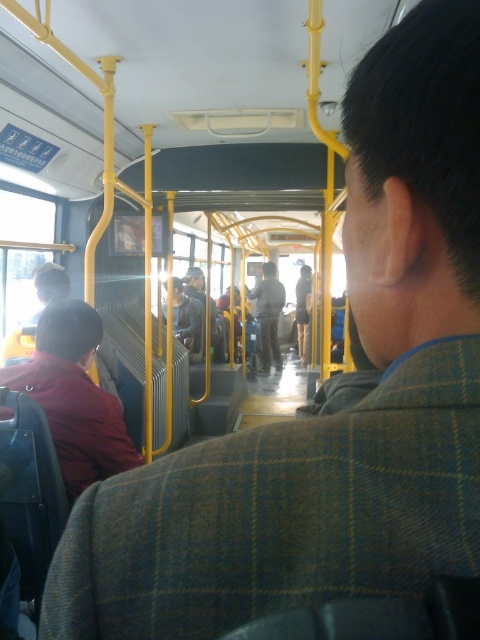
Can you confirm if dark gray sweater at center is bigger than dark gray leather jacket at center?

Actually, dark gray sweater at center might be smaller than dark gray leather jacket at center.

Is dark gray sweater at center closer to the viewer compared to dark gray leather jacket at center?

Yes, dark gray sweater at center is closer to the viewer.

Between point (173, 300) and point (211, 301), which one is positioned in front?

Point (173, 300) is in front.

Where is `dark gray sweater at center`? The width and height of the screenshot is (480, 640). dark gray sweater at center is located at coordinates (186, 317).

Does maroon fabric jacket at left come in front of dark gray fabric jacket at center?

That is True.

Can you confirm if maroon fabric jacket at left is wider than dark gray fabric jacket at center?

In fact, maroon fabric jacket at left might be narrower than dark gray fabric jacket at center.

Between point (96, 444) and point (269, 346), which one is positioned in front?

Point (96, 444) is in front.

The height and width of the screenshot is (640, 480). What are the coordinates of `maroon fabric jacket at left` in the screenshot? It's located at (73, 396).

Locate an element on the screen. The image size is (480, 640). maroon fabric jacket at left is located at coordinates (73, 396).

Does maroon fabric jacket at left have a greater height compared to dark gray sweater at center?

In fact, maroon fabric jacket at left may be shorter than dark gray sweater at center.

Who is more forward, (66, 417) or (180, 333)?

Positioned in front is point (66, 417).

Locate an element on the screen. maroon fabric jacket at left is located at coordinates (73, 396).